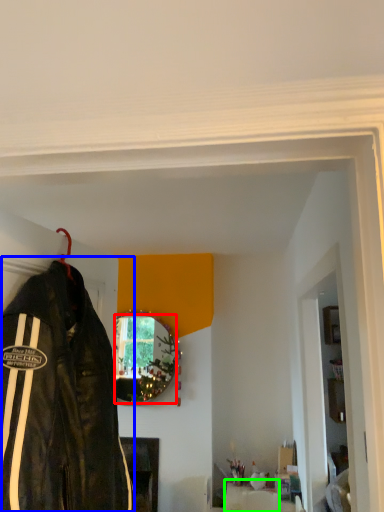
Question: Considering the real-world distances, which object is farthest from mirror (highlighted by a red box)? jacket (highlighted by a blue box) or furniture (highlighted by a green box)?

Choices:
 (A) jacket
 (B) furniture

Answer: (A)